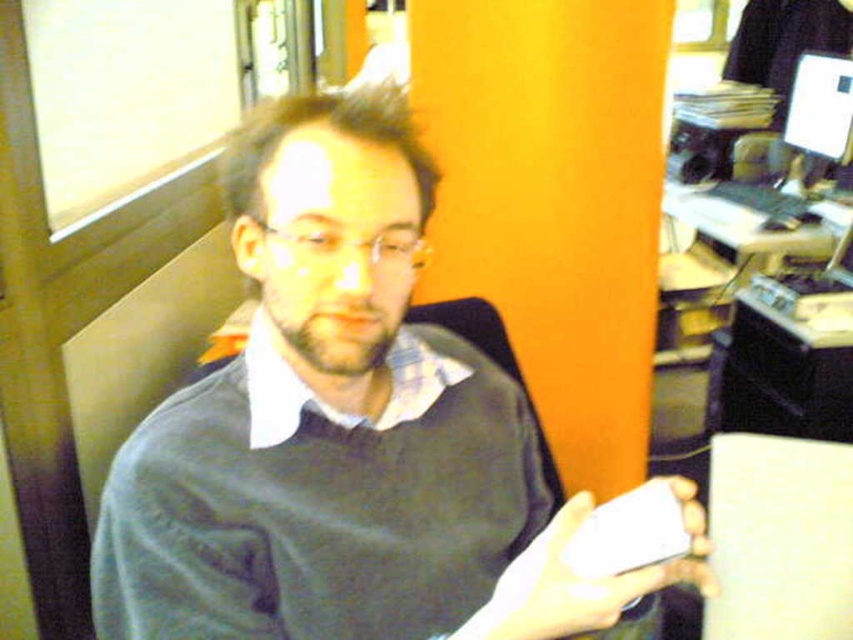
Question: Which of the following is the farthest from the observer?

Choices:
 (A) white matte phone at center
 (B) matte gray sweater at center

Answer: (B)

Question: Can you confirm if matte gray sweater at center is positioned to the right of white matte phone at center?

Choices:
 (A) no
 (B) yes

Answer: (A)

Question: Is matte gray sweater at center closer to camera compared to white matte phone at center?

Choices:
 (A) yes
 (B) no

Answer: (B)

Question: Is matte gray sweater at center positioned in front of white matte phone at center?

Choices:
 (A) yes
 (B) no

Answer: (B)